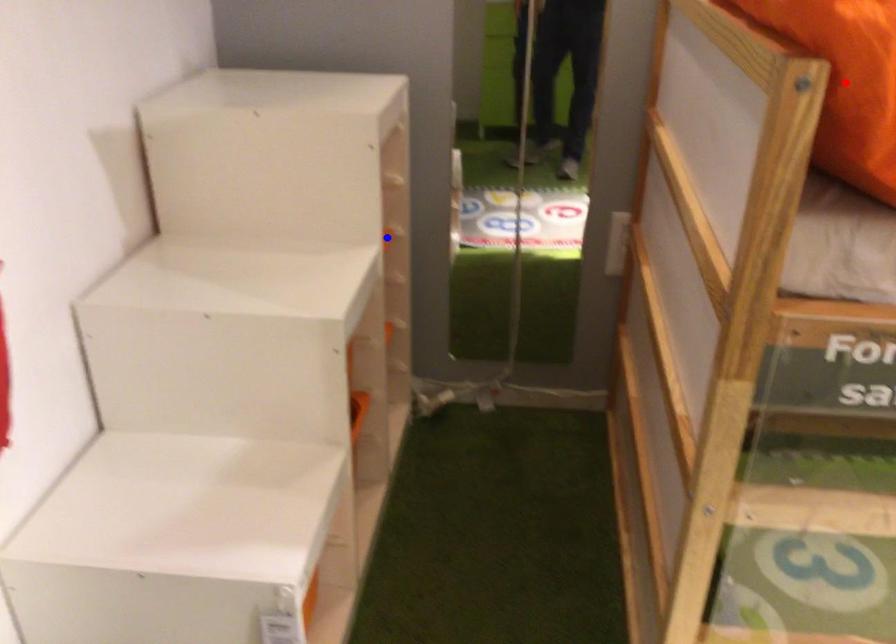
Question: Two points are marked on the image. Which point is closer to the camera?

Choices:
 (A) Blue point is closer.
 (B) Red point is closer.

Answer: (B)